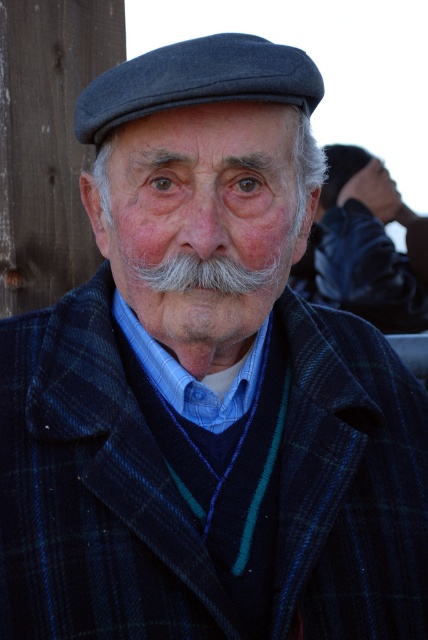
Describe the element at coordinates (201, 259) in the screenshot. I see `white mustache at center` at that location.

Which is below, white mustache at center or gray woolen cap at upper center?

white mustache at center

Does point (246, 192) come closer to viewer compared to point (379, 220)?

Yes, point (246, 192) is in front of point (379, 220).

Locate an element on the screen. The height and width of the screenshot is (640, 428). white mustache at center is located at coordinates (201, 259).

Is gray woolen cap at upper center smaller than dark blue felt cap at upper center?

No, gray woolen cap at upper center is not smaller than dark blue felt cap at upper center.

Between point (326, 264) and point (303, 93), which one is positioned behind?

The point (326, 264) is more distant.

This screenshot has width=428, height=640. Find the location of `gray woolen cap at upper center`. gray woolen cap at upper center is located at coordinates (359, 248).

Is point (177, 337) closer to camera compared to point (228, 42)?

No, (177, 337) is further to viewer.

Does white mustache at center appear on the right side of dark blue felt cap at upper center?

Yes, white mustache at center is to the right of dark blue felt cap at upper center.

This screenshot has height=640, width=428. What do you see at coordinates (201, 259) in the screenshot?
I see `white mustache at center` at bounding box center [201, 259].

This screenshot has width=428, height=640. I want to click on white mustache at center, so click(x=201, y=259).